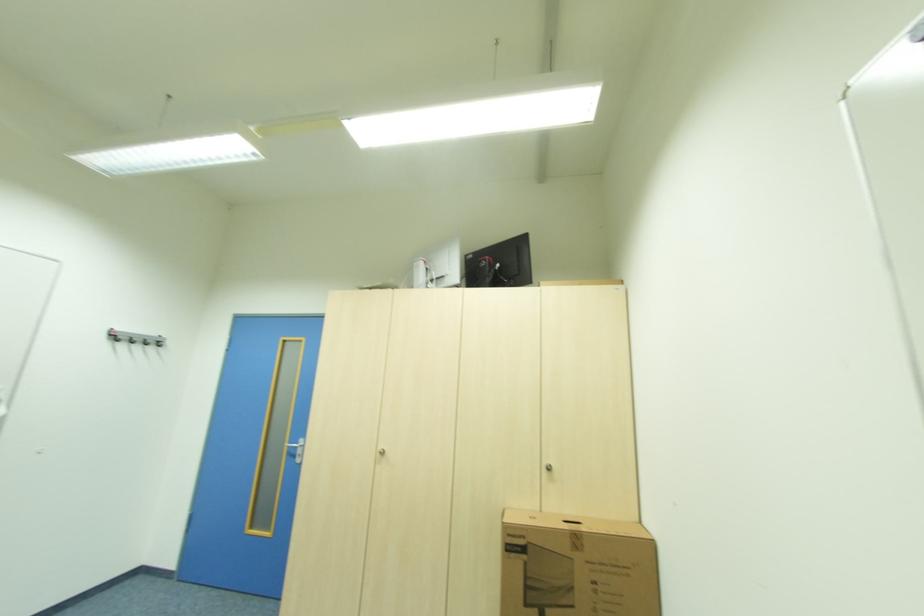
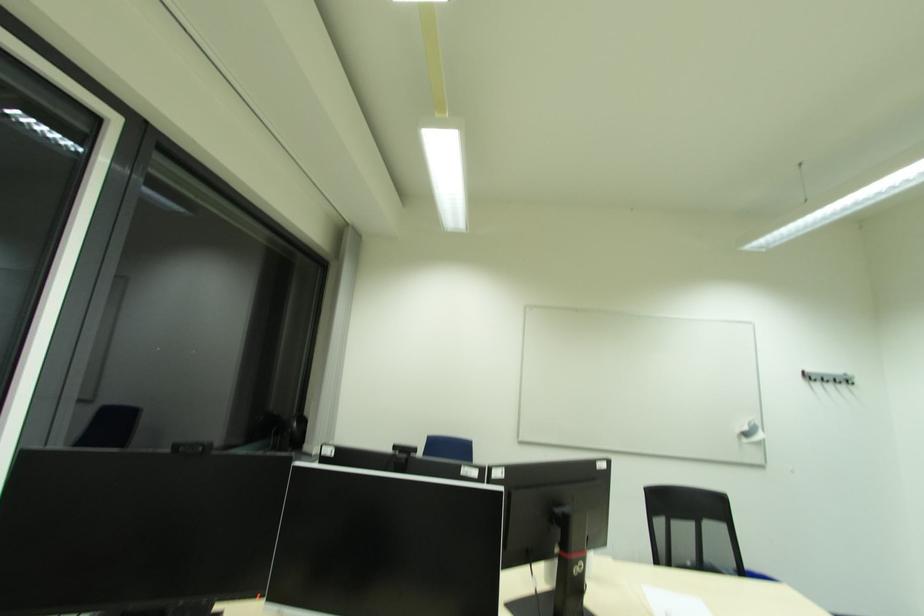
Question: How did the camera likely rotate?

Choices:
 (A) Left
 (B) Right
 (C) Up
 (D) Down

Answer: (A)